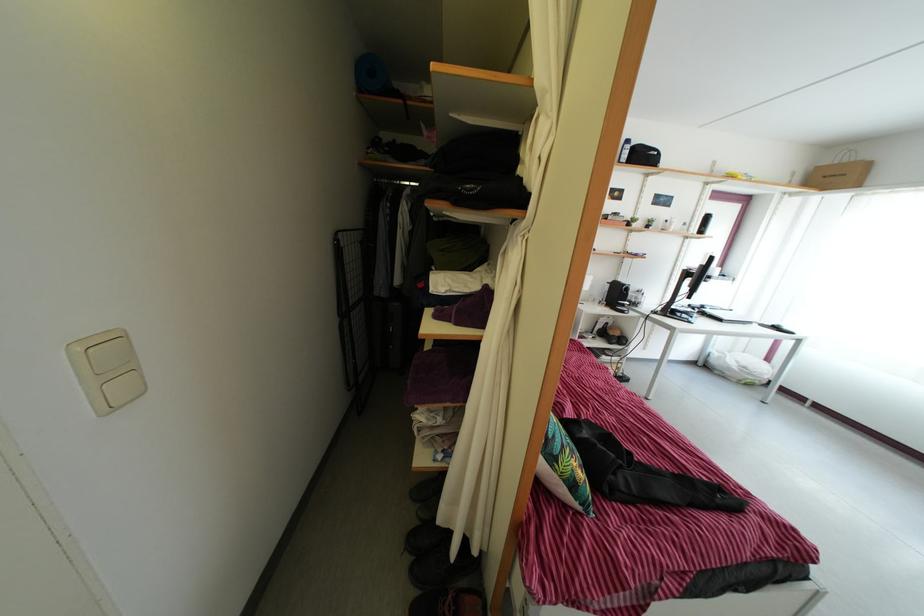
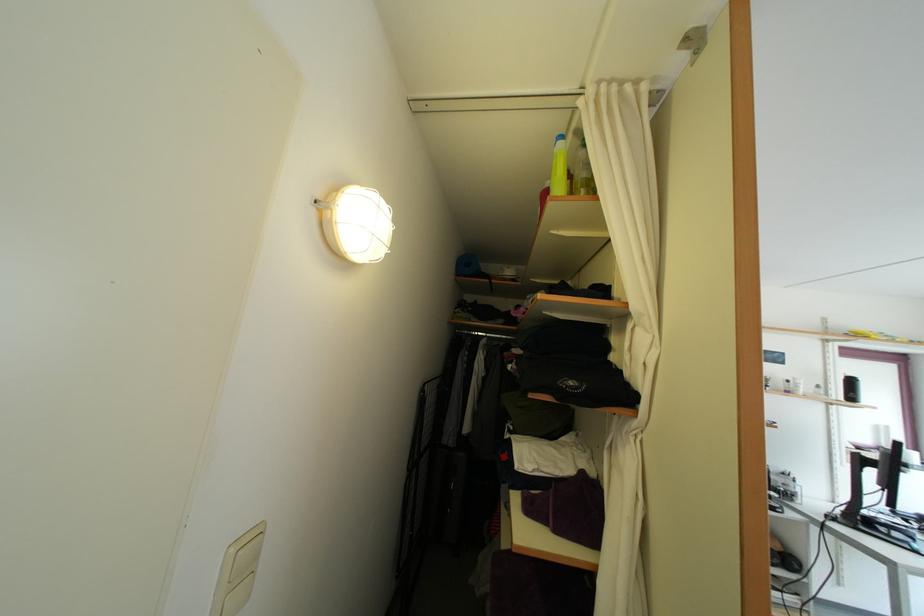
In the second image, find the point that corresponds to (489,345) in the first image.

(602, 576)